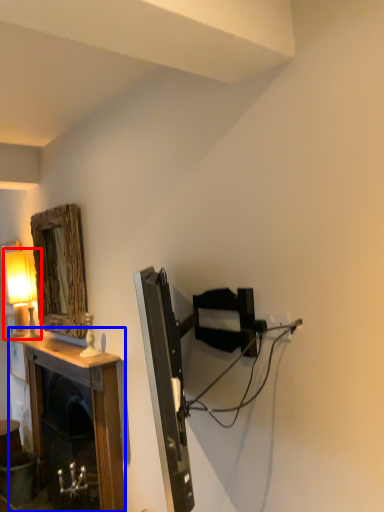
Question: Which object appears farthest to the camera in this image, table lamp (highlighted by a red box) or table (highlighted by a blue box)?

Choices:
 (A) table lamp
 (B) table

Answer: (A)